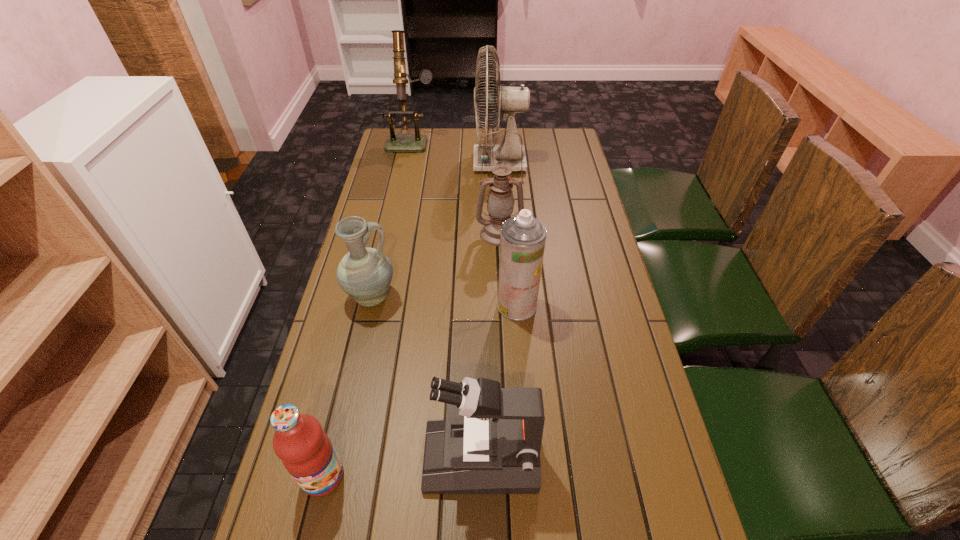
You are a GUI agent. You are given a task and a screenshot of the screen. Output one action in this format:
    pyautogui.click(x=<x>, y=<y>)
    Task: Click on the fan
    
    Given the screenshot: What is the action you would take?
    click(x=509, y=100)

Locate an element on the screen. This screenshot has height=540, width=960. the farther microscope is located at coordinates (416, 142).

Identify the location of the left microscope. (416, 142).

What are the coordinates of `the fifth nearest object` in the screenshot? It's located at (500, 203).

The image size is (960, 540). I want to click on aerosol can, so click(x=522, y=239).

Where is `the shorter microscope`? Image resolution: width=960 pixels, height=540 pixels. the shorter microscope is located at coordinates click(489, 443).

Identify the location of the nearer microscope. The width and height of the screenshot is (960, 540). coord(489,443).

Image resolution: width=960 pixels, height=540 pixels. I want to click on pitcher, so click(365, 274).

Identify the location of fruit juice. (306, 451).

Where is `free space located 0.270m on the front-facing side of the fan`? This screenshot has height=540, width=960. free space located 0.270m on the front-facing side of the fan is located at coordinates (404, 163).